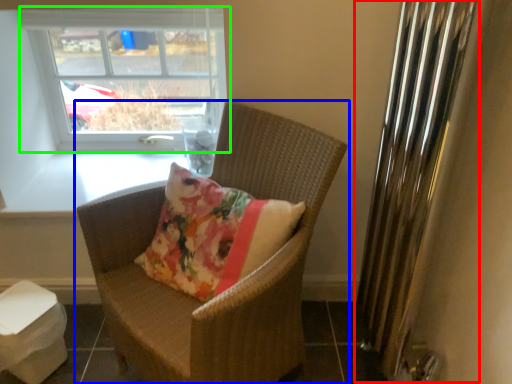
Question: Based on their relative distances, which object is farther from radiator (highlighted by a red box)? Choose from chair (highlighted by a blue box) and window (highlighted by a green box).

Choices:
 (A) chair
 (B) window

Answer: (B)